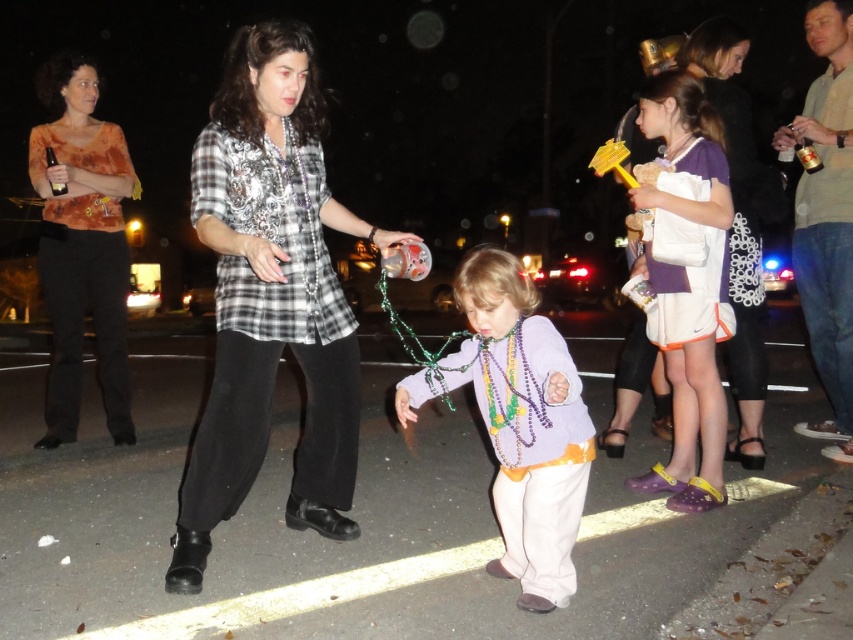
You are standing in the middle of the street during the event and see two points in the image. Which point is closer to you, point (x=376, y=236) or point (x=567, y=493)?

Point (x=376, y=236) is closer to you because it is further to the viewer than point (x=567, y=493).

You are a costume designer observing the festive scene. You need to determine which clothing item has a greater horizontal span to ensure proper fitting for a similar costume. Which one is wider between the plaid shirt at center and the purple matte shirt at center?

The plaid shirt at center has a larger width than the purple matte shirt at center, so it has a greater horizontal span.